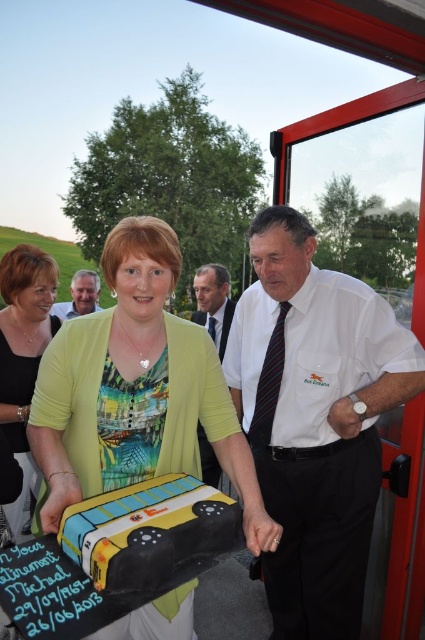
Does white striped tie at center come in front of yellow fondant bus at center?

That is False.

Can you confirm if white striped tie at center is taller than yellow fondant bus at center?

Indeed, white striped tie at center has a greater height compared to yellow fondant bus at center.

The width and height of the screenshot is (425, 640). I want to click on white striped tie at center, so click(314, 419).

The height and width of the screenshot is (640, 425). What are the coordinates of `white striped tie at center` in the screenshot? It's located at (314, 419).

Between white striped tie at center and matte yellow dress at center, which one is positioned lower?

white striped tie at center is below.

Is white striped tie at center taller than matte yellow dress at center?

Correct, white striped tie at center is much taller as matte yellow dress at center.

Image resolution: width=425 pixels, height=640 pixels. Find the location of `white striped tie at center`. white striped tie at center is located at coordinates (314, 419).

Who is more forward, [34,291] or [84,291]?

Point [34,291] is in front.

The height and width of the screenshot is (640, 425). Identify the location of matte green blouse at center. pos(23,353).